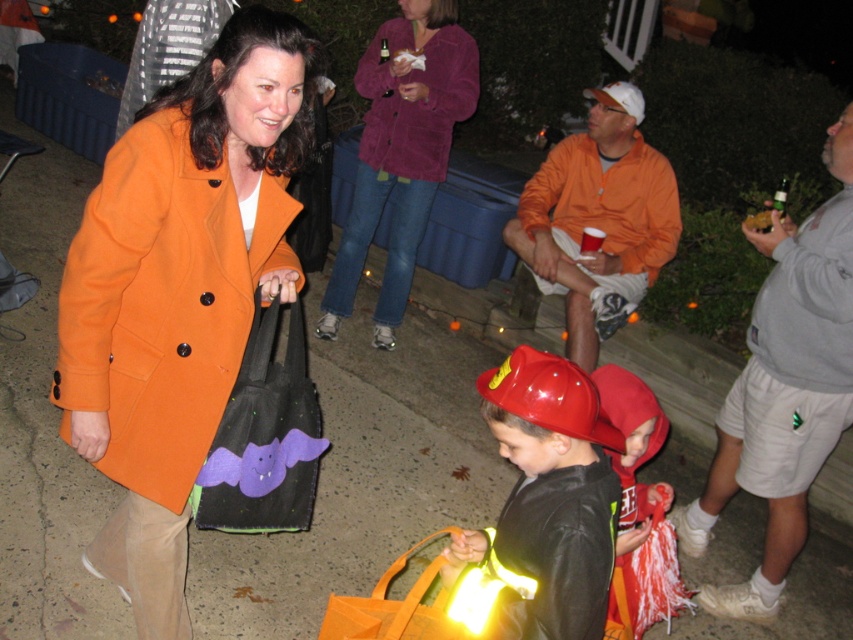
You are a photographer trying to capture a clear photo of both the reflective plastic fire helmet at center and the velvet purple coat at center. Since the scene is dimly lit, you need to adjust your camera settings. Which object should you focus on first to ensure it appears sharp in the photo?

The reflective plastic fire helmet at center is in front of the velvet purple coat at center, so you should focus on the reflective plastic fire helmet at center first to ensure it appears sharp in the photo.

You are a photographer trying to capture a group photo of the purple corduroy sweater at upper center and the red matte fire helmet at center. Since you want both subjects to be clearly visible in the frame, which one should you focus on first to ensure proper alignment?

The purple corduroy sweater at upper center should be focused on first because it is positioned to the left of the red matte fire helmet at center, allowing the photographer to adjust the frame to include both subjects properly.